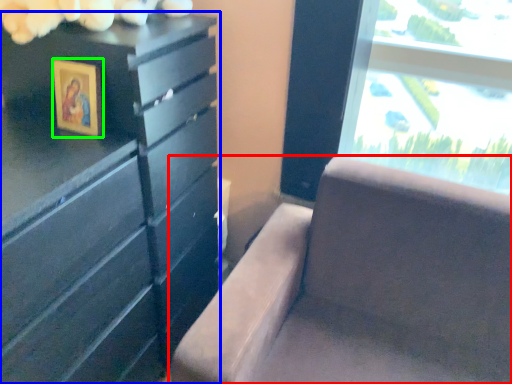
Question: Which object is the closest to the furniture (highlighted by a red box)? Choose among these: chest of drawers (highlighted by a blue box) or picture frame (highlighted by a green box).

Choices:
 (A) chest of drawers
 (B) picture frame

Answer: (A)